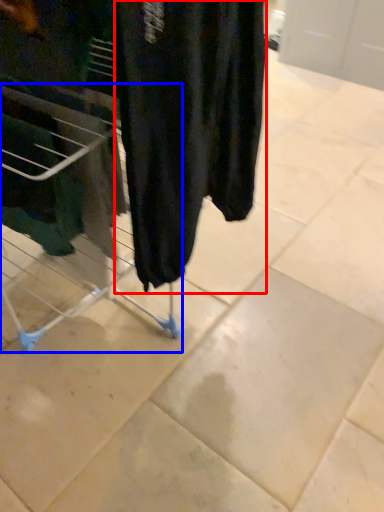
Question: Which of the following is the closest to the observer, clothing (highlighted by a red box) or furniture (highlighted by a blue box)?

Choices:
 (A) clothing
 (B) furniture

Answer: (A)